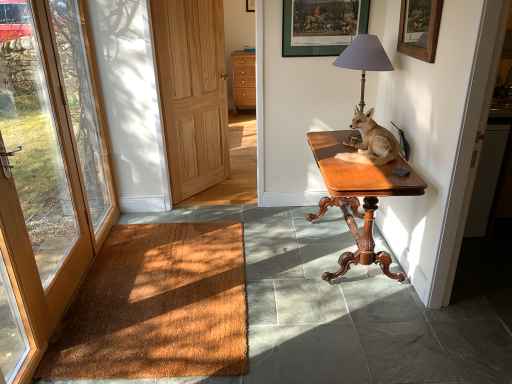
Question: Should I look upward or downward to see light brown wood door at center, the 2th door when ordered from left to right?

Choices:
 (A) down
 (B) up

Answer: (B)

Question: Could you tell me if mahogany wood desk at right is facing wooden framed picture at upper right, which is counted as the 1th picture frame, starting from the right?

Choices:
 (A) yes
 (B) no

Answer: (B)

Question: From the image's perspective, would you say mahogany wood desk at right is shown under wooden framed picture at upper right, the second picture frame from the left?

Choices:
 (A) yes
 (B) no

Answer: (A)

Question: Would you consider mahogany wood desk at right to be distant from wooden framed picture at upper right, the 1th picture frame positioned from the front?

Choices:
 (A) no
 (B) yes

Answer: (A)

Question: Is mahogany wood desk at right to the right of wooden framed picture at upper right, the 1th picture frame positioned from the front, from the viewer's perspective?

Choices:
 (A) yes
 (B) no

Answer: (B)

Question: Is mahogany wood desk at right positioned behind wooden framed picture at upper right, which is the second picture frame in back-to-front order?

Choices:
 (A) no
 (B) yes

Answer: (B)

Question: Can you confirm if mahogany wood desk at right is wider than wooden framed picture at upper right, the second picture frame from the left?

Choices:
 (A) yes
 (B) no

Answer: (A)

Question: Does brown wood door at left, the 1th door viewed from the left, lie in front of wooden framed picture at upper right, the 1th picture frame positioned from the front?

Choices:
 (A) no
 (B) yes

Answer: (B)

Question: Is brown wood door at left, the 1th door viewed from the left, outside wooden framed picture at upper right, the second picture frame from the left?

Choices:
 (A) yes
 (B) no

Answer: (A)

Question: Can you confirm if brown wood door at left, the 1th door viewed from the left, is wider than wooden framed picture at upper right, the 1th picture frame positioned from the front?

Choices:
 (A) yes
 (B) no

Answer: (A)

Question: Considering the relative positions of brown wood door at left, which appears as the 2th door when viewed from the right, and wooden framed picture at upper right, the 1th picture frame positioned from the front, in the image provided, is brown wood door at left, which appears as the 2th door when viewed from the right, behind wooden framed picture at upper right, the 1th picture frame positioned from the front,?

Choices:
 (A) no
 (B) yes

Answer: (A)

Question: Is brown wood door at left, the 1th door viewed from the left, smaller than wooden framed picture at upper right, the 1th picture frame positioned from the front?

Choices:
 (A) yes
 (B) no

Answer: (B)

Question: From the image's perspective, does brown wood door at left, the 1th door viewed from the left, appear higher than wooden framed picture at upper right, the 1th picture frame positioned from the front?

Choices:
 (A) no
 (B) yes

Answer: (A)

Question: From a real-world perspective, is light brown fur at table right positioned over light brown wood drawers at center based on gravity?

Choices:
 (A) no
 (B) yes

Answer: (B)